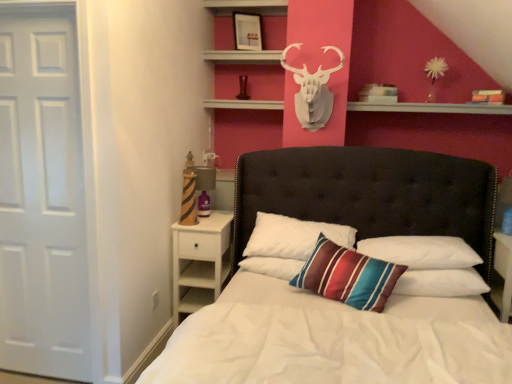
Question: Does white wood nightstand at lower left appear on the right side of striped fabric pillow at center, marked as the 3th pillow in a left-to-right arrangement?

Choices:
 (A) no
 (B) yes

Answer: (A)

Question: Can you confirm if white wood nightstand at lower left is bigger than striped fabric pillow at center, marked as the 3th pillow in a left-to-right arrangement?

Choices:
 (A) yes
 (B) no

Answer: (A)

Question: Does white wood nightstand at lower left turn towards striped fabric pillow at center, marked as the 3th pillow in a left-to-right arrangement?

Choices:
 (A) yes
 (B) no

Answer: (B)

Question: Is white wood nightstand at lower left with striped fabric pillow at center, marked as the 3th pillow in a left-to-right arrangement?

Choices:
 (A) no
 (B) yes

Answer: (A)

Question: Considering the relative sizes of white wood nightstand at lower left and striped fabric pillow at center, marked as the 1th pillow in a right-to-left arrangement, in the image provided, is white wood nightstand at lower left wider than striped fabric pillow at center, marked as the 1th pillow in a right-to-left arrangement,?

Choices:
 (A) no
 (B) yes

Answer: (B)

Question: Is white matte door at left inside or outside of white soft pillow at center, which is counted as the first pillow, starting from the left?

Choices:
 (A) outside
 (B) inside

Answer: (A)

Question: Does point (10, 102) appear closer or farther from the camera than point (280, 274)?

Choices:
 (A) farther
 (B) closer

Answer: (B)

Question: Based on their sizes in the image, would you say white matte door at left is bigger or smaller than white soft pillow at center, which is counted as the first pillow, starting from the left?

Choices:
 (A) big
 (B) small

Answer: (A)

Question: In terms of width, does white matte door at left look wider or thinner when compared to white soft pillow at center, placed as the third pillow when sorted from right to left?

Choices:
 (A) thin
 (B) wide

Answer: (A)

Question: From a real-world perspective, is white matte door at left positioned above or below striped fabric pillow at center, marked as the second pillow in a right-to-left arrangement?

Choices:
 (A) above
 (B) below

Answer: (A)

Question: In terms of height, does white matte door at left look taller or shorter compared to striped fabric pillow at center, the 2th pillow from the left?

Choices:
 (A) tall
 (B) short

Answer: (A)

Question: From the image's perspective, is white matte door at left positioned above or below striped fabric pillow at center, marked as the second pillow in a right-to-left arrangement?

Choices:
 (A) above
 (B) below

Answer: (A)

Question: Considering the positions of white matte door at left and striped fabric pillow at center, the 2th pillow from the left, in the image, is white matte door at left bigger or smaller than striped fabric pillow at center, the 2th pillow from the left,?

Choices:
 (A) small
 (B) big

Answer: (B)

Question: Looking at the image, does white matte/decorative deer head at upper center seem bigger or smaller compared to white matte door at left?

Choices:
 (A) big
 (B) small

Answer: (B)

Question: Relative to white matte door at left, is white matte/decorative deer head at upper center in front or behind?

Choices:
 (A) behind
 (B) front

Answer: (A)